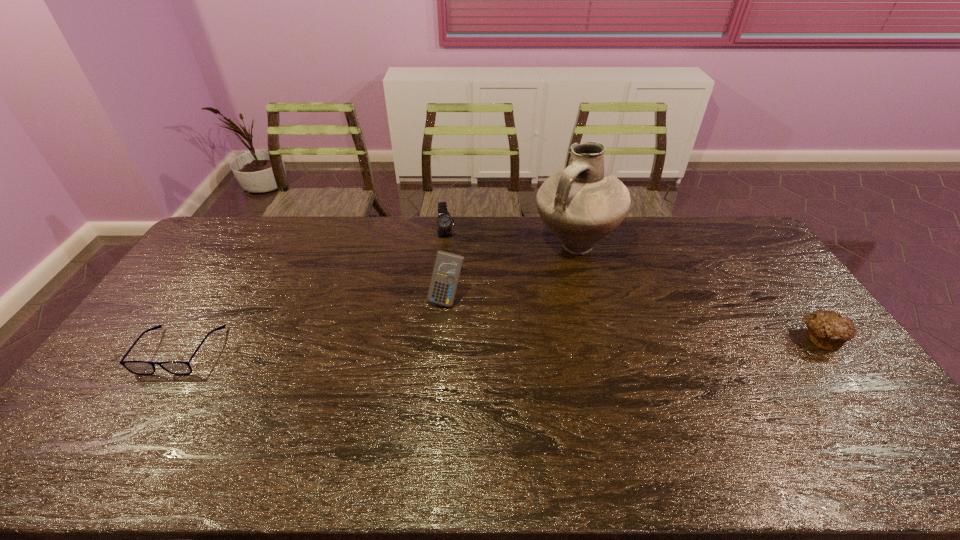
In order to click on unoccupied position between the spectacles and the third tallest object in this screenshot , I will do `click(313, 292)`.

Find the location of `free space between the rightmost object and the watch`. free space between the rightmost object and the watch is located at coordinates (634, 286).

Locate an element on the screen. This screenshot has height=540, width=960. free spot between the spectacles and the second shortest object is located at coordinates (501, 344).

The image size is (960, 540). I want to click on vacant space that is in between the pitcher and the third tallest object, so click(x=510, y=239).

This screenshot has height=540, width=960. Find the location of `free space between the pitcher and the shortest object`. free space between the pitcher and the shortest object is located at coordinates (377, 298).

Image resolution: width=960 pixels, height=540 pixels. In order to click on vacant region between the shortest object and the calculator in this screenshot , I will do `click(314, 325)`.

You are a GUI agent. You are given a task and a screenshot of the screen. Output one action in this format:
    pyautogui.click(x=<x>, y=<y>)
    Task: Click on the vacant region between the rightmost object and the shortest object
    This screenshot has height=540, width=960.
    Given the screenshot: What is the action you would take?
    pyautogui.click(x=501, y=344)

Locate an element on the screen. free spot between the third shortest object and the spectacles is located at coordinates (313, 292).

Identify the location of free spot between the watch and the leftmost object. (313, 292).

Image resolution: width=960 pixels, height=540 pixels. What are the coordinates of `vacant point located between the rightmost object and the tallest object` in the screenshot? It's located at (698, 292).